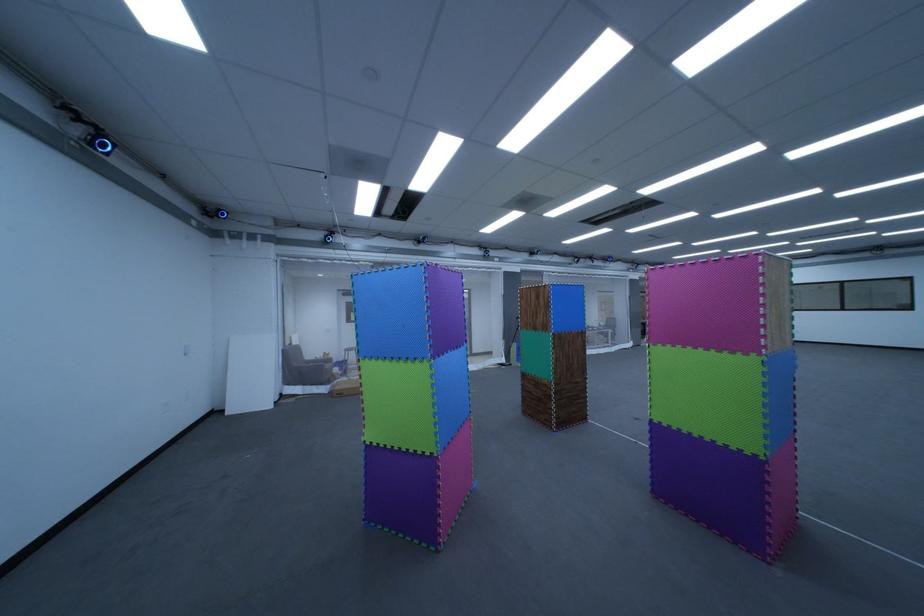
Locate an element on the screen. gray chair armrest is located at coordinates (307, 373).